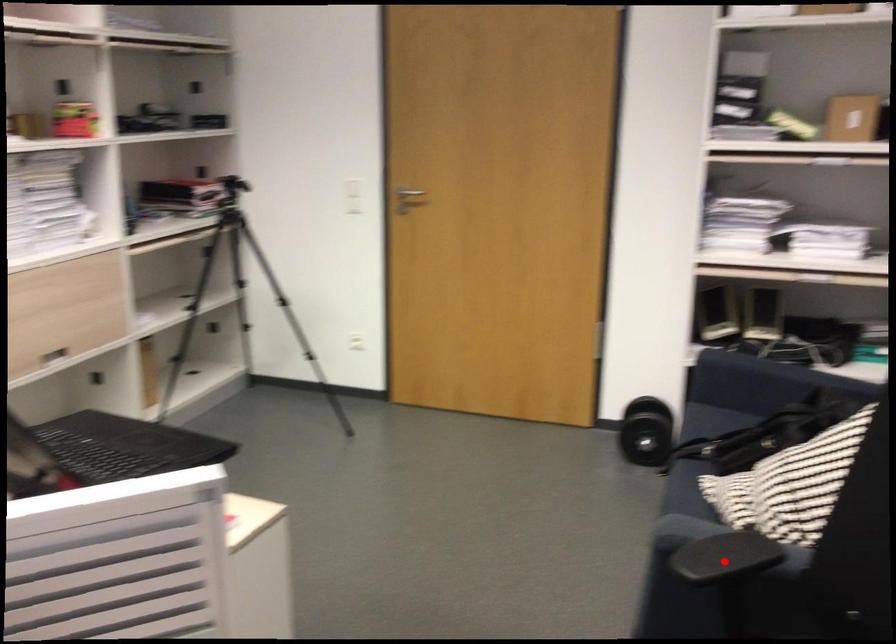
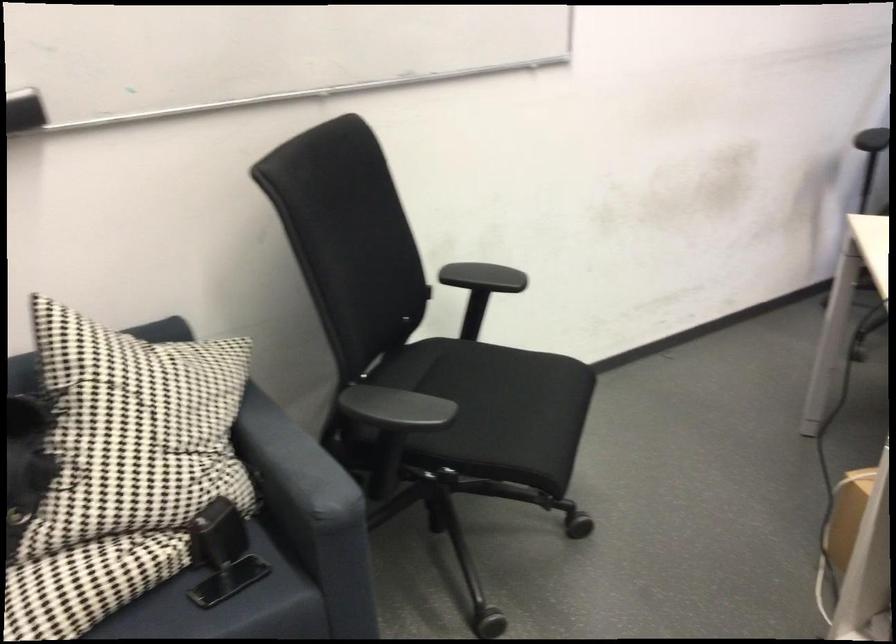
In the second image, find the point that corresponds to the highlighted location in the first image.

(395, 408)